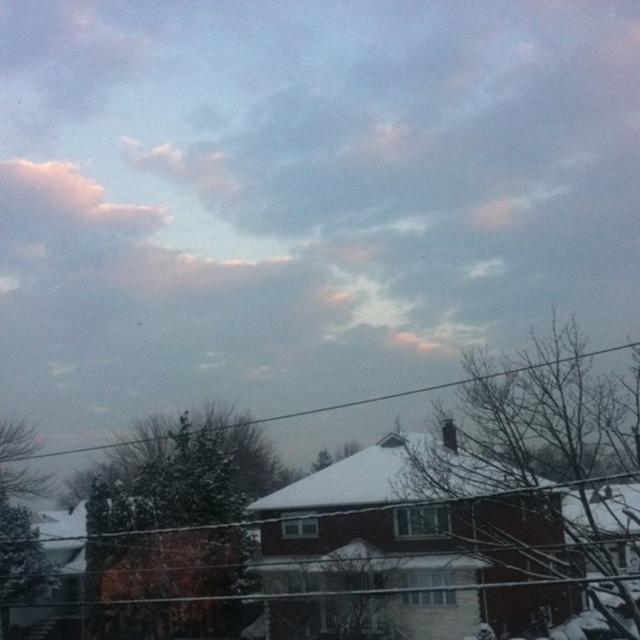
Who is taller, puffy white cloud at upper left or black wire at upper center?

Standing taller between the two is black wire at upper center.

Can you confirm if puffy white cloud at upper left is thinner than black wire at upper center?

Indeed, puffy white cloud at upper left has a lesser width compared to black wire at upper center.

Locate an element on the screen. The image size is (640, 640). puffy white cloud at upper left is located at coordinates (64, 202).